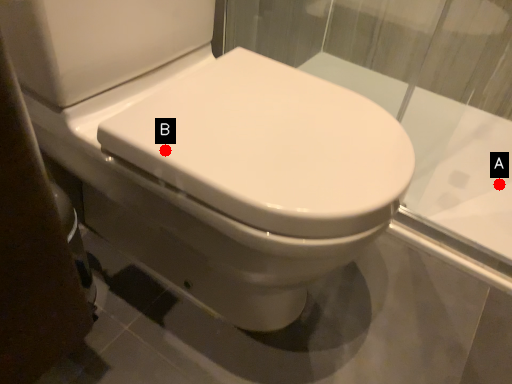
Question: Two points are circled on the image, labeled by A and B beside each circle. Among these points, which one is farthest from the camera?

Choices:
 (A) A is further
 (B) B is further

Answer: (A)